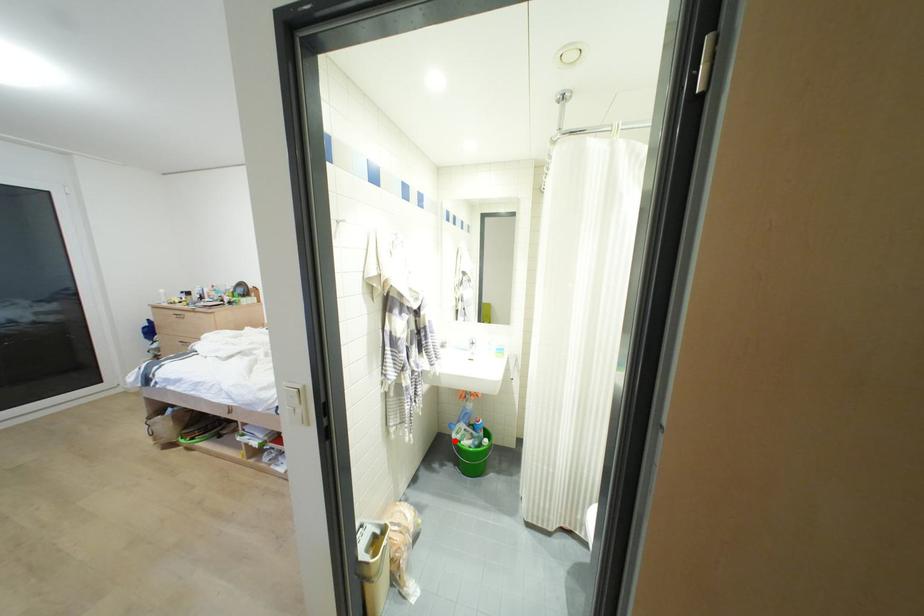
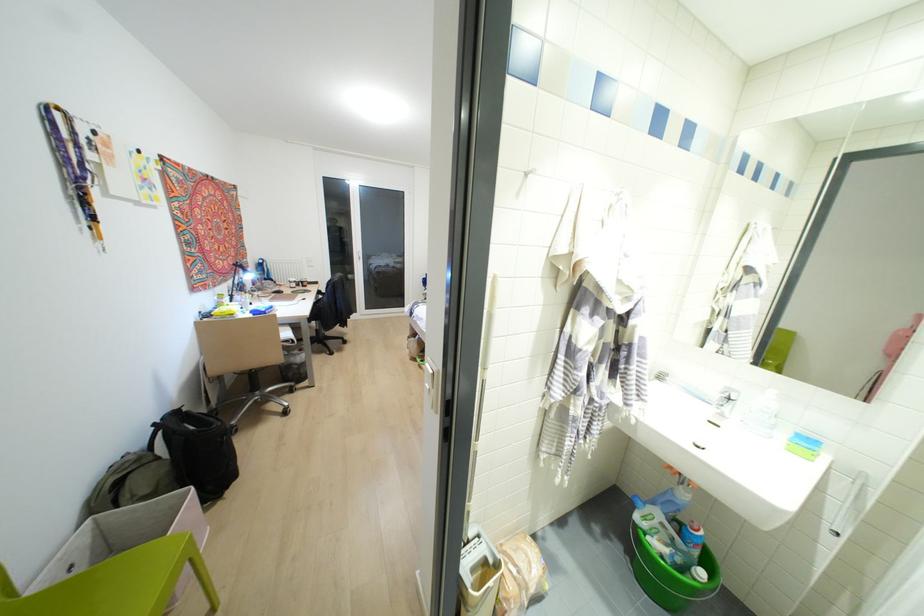
In the second image, find the point that corresponds to the highlighted location in the first image.

(636, 525)